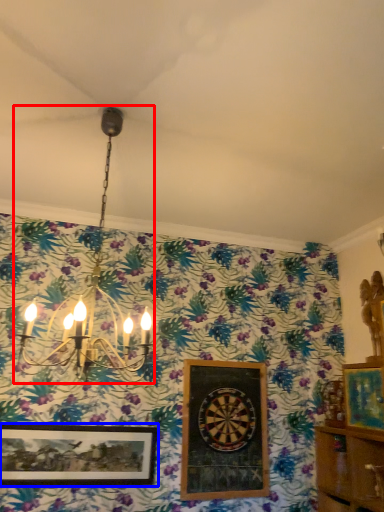
Question: Which object appears farthest to the camera in this image, lamp (highlighted by a red box) or picture frame (highlighted by a blue box)?

Choices:
 (A) lamp
 (B) picture frame

Answer: (B)